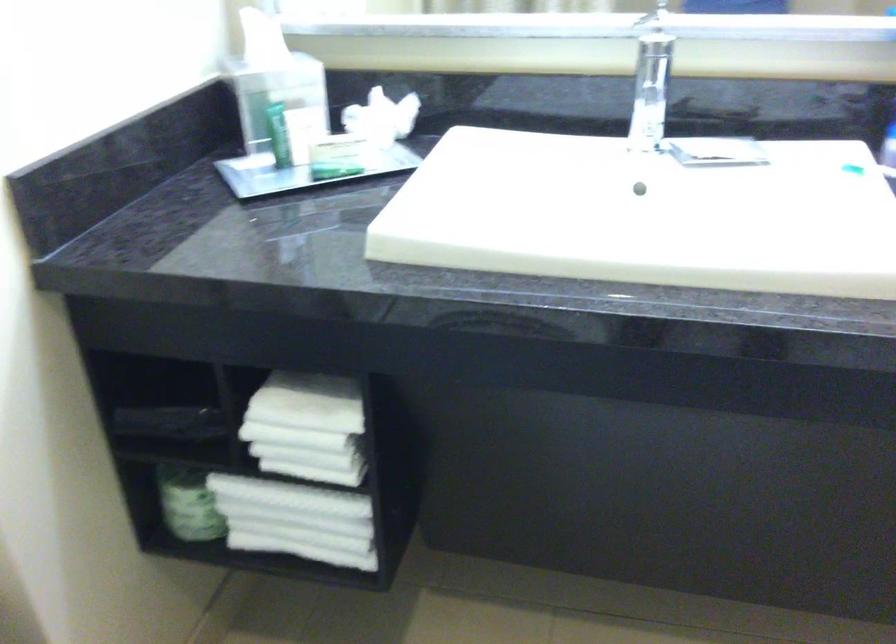
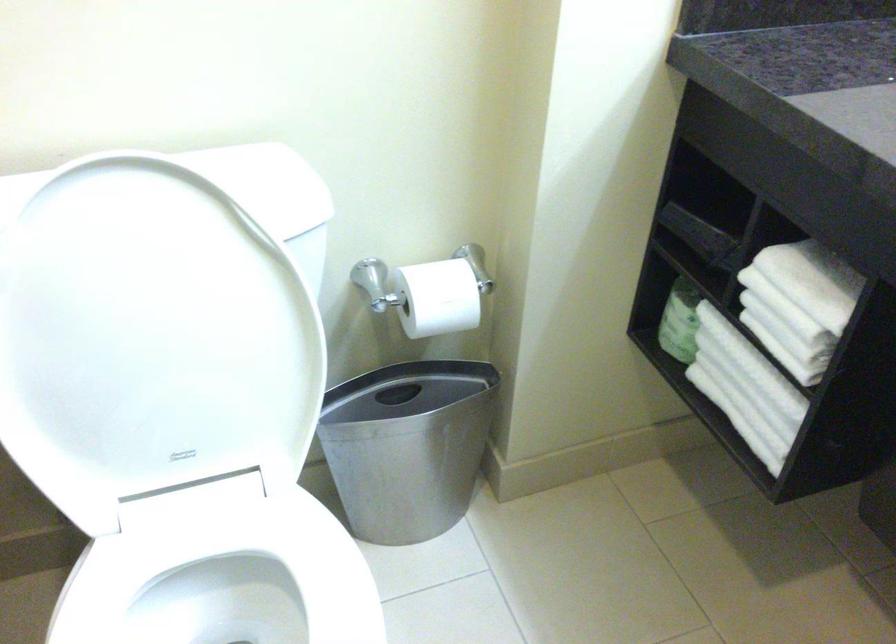
Find the pixel in the second image that matches point (298, 520) in the first image.

(745, 388)